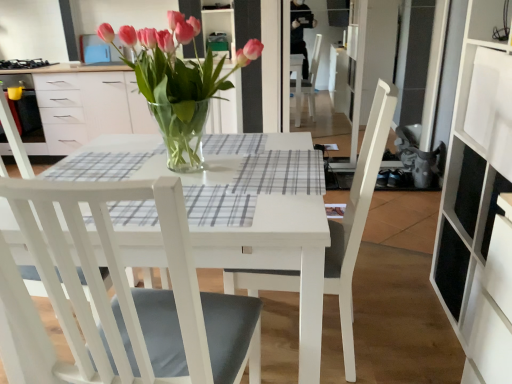
What do you see at coordinates (281, 173) in the screenshot? I see `gray checkered placemat at center` at bounding box center [281, 173].

What do you see at coordinates (24, 64) in the screenshot? I see `black matte gas stove at upper left` at bounding box center [24, 64].

The image size is (512, 384). Find the location of `white matte chair at center, placed as the first chair when sorted from left to right`. white matte chair at center, placed as the first chair when sorted from left to right is located at coordinates (123, 296).

Considering the positions of objects white matte chair at center, placed as the first chair when sorted from left to right, and gray checkered placemat at center in the image provided, who is in front, white matte chair at center, placed as the first chair when sorted from left to right, or gray checkered placemat at center?

Positioned in front is white matte chair at center, placed as the first chair when sorted from left to right.

How different are the orientations of white matte chair at center, placed as the first chair when sorted from left to right, and gray checkered placemat at center in degrees?

They differ by 0.000325 degrees in their facing directions.

Locate an element on the screen. The height and width of the screenshot is (384, 512). plaid on the right of white matte chair at center, which is counted as the 2th chair, starting from the right is located at coordinates (281, 173).

Is white matte chair at center, which is counted as the 2th chair, starting from the right, not near gray checkered placemat at center?

That's not correct — white matte chair at center, which is counted as the 2th chair, starting from the right, is a little close to gray checkered placemat at center.

Considering the positions of points (381, 137) and (500, 318), is point (381, 137) farther from camera compared to point (500, 318)?

Yes.

Is white matte cabinet at right at the back of white wood chair at center, placed as the 2th chair when sorted from left to right?

Yes, white wood chair at center, placed as the 2th chair when sorted from left to right,'s orientation is away from white matte cabinet at right.

How much distance is there between white wood chair at center, placed as the 2th chair when sorted from left to right, and white matte cabinet at right?

white wood chair at center, placed as the 2th chair when sorted from left to right, is 18.33 inches from white matte cabinet at right.

From the image's perspective, which is below, white wood chair at center, acting as the 1th chair starting from the right, or white matte cabinet at right?

white wood chair at center, acting as the 1th chair starting from the right, appears lower in the image.

Is black matte gas stove at upper left situated inside white wood chair at center, placed as the 2th chair when sorted from left to right, or outside?

black matte gas stove at upper left exists outside the volume of white wood chair at center, placed as the 2th chair when sorted from left to right.

Can you tell me how much black matte gas stove at upper left and white wood chair at center, acting as the 1th chair starting from the right, differ in facing direction?

94.7 degrees separate the facing orientations of black matte gas stove at upper left and white wood chair at center, acting as the 1th chair starting from the right.

From the picture: Are black matte gas stove at upper left and white wood chair at center, placed as the 2th chair when sorted from left to right, far apart?

Yes.

From a real-world perspective, is black matte gas stove at upper left physically above white wood chair at center, acting as the 1th chair starting from the right?

Indeed, from a real-world perspective, black matte gas stove at upper left stands above white wood chair at center, acting as the 1th chair starting from the right.

Consider the image. From the image's perspective, which is above, pink glass vase at center or white wood chair at center, acting as the 1th chair starting from the right?

pink glass vase at center.

Consider the image. Considering the relative sizes of pink glass vase at center and white wood chair at center, placed as the 2th chair when sorted from left to right, in the image provided, is pink glass vase at center thinner than white wood chair at center, placed as the 2th chair when sorted from left to right,?

Yes.

Relative to white wood chair at center, placed as the 2th chair when sorted from left to right, is pink glass vase at center in front or behind?

Clearly, pink glass vase at center is behind white wood chair at center, placed as the 2th chair when sorted from left to right.

Who is shorter, black matte gas stove at upper left or gray checkered placemat at center?

With less height is gray checkered placemat at center.

Locate an element on the screen. The image size is (512, 384). gas stove above the gray checkered placemat at center (from the image's perspective) is located at coordinates (24, 64).

Is black matte gas stove at upper left looking in the opposite direction of gray checkered placemat at center?

black matte gas stove at upper left does not have its back to gray checkered placemat at center.

Which object is further away from the camera, black matte gas stove at upper left or gray checkered placemat at center?

black matte gas stove at upper left is further away from the camera.

Considering the relative sizes of white matte cabinet at right and pink glass vase at center in the image provided, is white matte cabinet at right shorter than pink glass vase at center?

Incorrect, the height of white matte cabinet at right does not fall short of that of pink glass vase at center.

Who is more distant, white matte cabinet at right or pink glass vase at center?

pink glass vase at center is further from the camera.

Does white matte cabinet at right have a greater width compared to pink glass vase at center?

No, white matte cabinet at right is not wider than pink glass vase at center.

Can you tell me how much white matte cabinet at right and pink glass vase at center differ in facing direction?

white matte cabinet at right and pink glass vase at center are facing 0.656 degrees away from each other.

Considering the sizes of objects white matte cabinet at right and black matte gas stove at upper left in the image provided, who is bigger, white matte cabinet at right or black matte gas stove at upper left?

white matte cabinet at right.

Is point (460, 157) positioned behind point (31, 63)?

No, it is in front of (31, 63).

Is white matte cabinet at right turned away from black matte gas stove at upper left?

No, white matte cabinet at right is not facing away from black matte gas stove at upper left.

This screenshot has height=384, width=512. What are the coordinates of `plaid that is behind the white matte chair at center, placed as the first chair when sorted from left to right` in the screenshot? It's located at (281, 173).

Locate an element on the screen. The image size is (512, 384). the 1st chair located beneath the white matte cabinet at right (from a real-world perspective) is located at coordinates (357, 218).

Looking at the image, which one is located closer to black matte gas stove at upper left, gray checkered placemat at center or pink glass vase at center?

pink glass vase at center is closer to black matte gas stove at upper left.

When comparing their distances from white wood chair at center, placed as the 2th chair when sorted from left to right, does black matte gas stove at upper left or white matte chair at center, which is counted as the 2th chair, starting from the right, seem further?

Among the two, black matte gas stove at upper left is located further to white wood chair at center, placed as the 2th chair when sorted from left to right.

From the image, which object appears to be farther from white wood chair at center, placed as the 2th chair when sorted from left to right, black matte gas stove at upper left or pink glass vase at center?

black matte gas stove at upper left is further to white wood chair at center, placed as the 2th chair when sorted from left to right.

Which object lies further to the anchor point gray checkered placemat at center, white matte chair at center, placed as the first chair when sorted from left to right, or pink glass vase at center?

Among the two, white matte chair at center, placed as the first chair when sorted from left to right, is located further to gray checkered placemat at center.

Based on their spatial positions, is black matte gas stove at upper left or white wood chair at center, placed as the 2th chair when sorted from left to right, closer to pink glass vase at center?

white wood chair at center, placed as the 2th chair when sorted from left to right, is positioned closer to the anchor pink glass vase at center.

From the image, which object appears to be farther from gray checkered placemat at center, white wood chair at center, acting as the 1th chair starting from the right, or pink glass vase at center?

Among the two, pink glass vase at center is located further to gray checkered placemat at center.

In the scene shown: Estimate the real-world distances between objects in this image. Which object is closer to white matte chair at center, which is counted as the 2th chair, starting from the right, white wood chair at center, acting as the 1th chair starting from the right, or gray checkered placemat at center?

The object closer to white matte chair at center, which is counted as the 2th chair, starting from the right, is gray checkered placemat at center.

Considering their positions, is white matte cabinet at right positioned closer to white wood chair at center, acting as the 1th chair starting from the right, than pink glass vase at center?

white matte cabinet at right is positioned closer to the anchor white wood chair at center, acting as the 1th chair starting from the right.

Identify the location of chair between gray checkered placemat at center and white matte cabinet at right from left to right. (357, 218).

This screenshot has height=384, width=512. Identify the location of chair between pink glass vase at center and white matte cabinet at right in the horizontal direction. click(357, 218).

Find the location of `chair between pink glass vase at center and white matte chair at center, which is counted as the 2th chair, starting from the right, vertically`. chair between pink glass vase at center and white matte chair at center, which is counted as the 2th chair, starting from the right, vertically is located at coordinates pos(357,218).

Where is `plaid between white matte chair at center, which is counted as the 2th chair, starting from the right, and black matte gas stove at upper left in the front-back direction`? The image size is (512, 384). plaid between white matte chair at center, which is counted as the 2th chair, starting from the right, and black matte gas stove at upper left in the front-back direction is located at coordinates (281, 173).